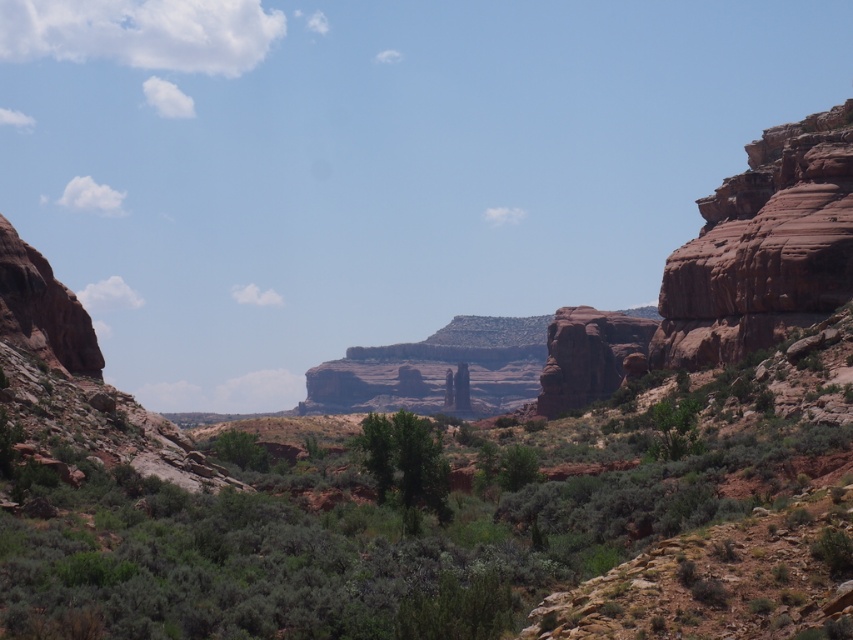
You are standing in the desert and see two points marked in the image. The first point is at coordinates point (851, 204), and the second point is at point (577, 385). Which point is nearer to you?

Point (851, 204) is closer to the viewer than point (577, 385).

You are a hiker planning to set up a campsite in the desert. You see the green shrubbery at center and the green leafy tree at center. Which of these two plants would you choose to set up your tent closer to, considering shade availability?

The green leafy tree at center is likely taller and provides more shade than the green shrubbery at center, so you should set up your tent closer to the green leafy tree at center for better shade.